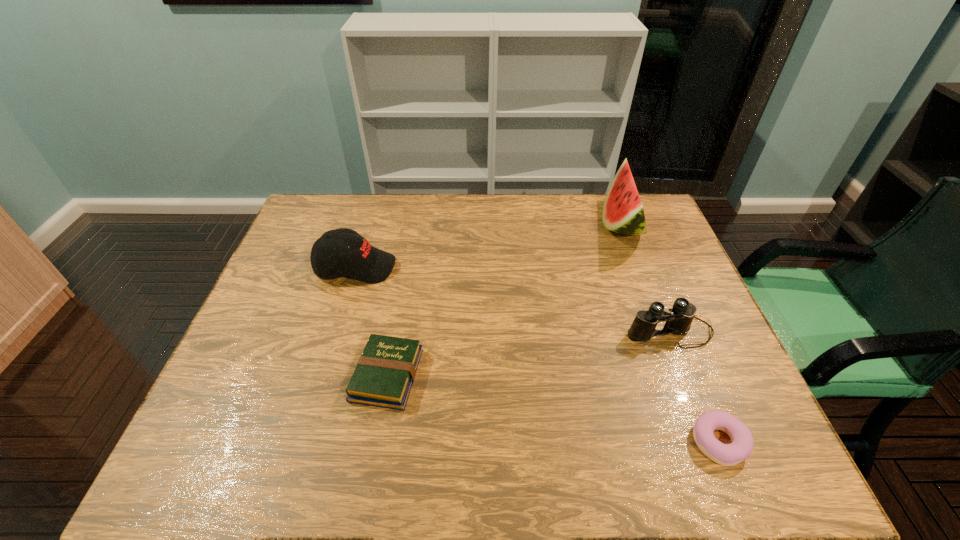
Where is `the tallest object`? Image resolution: width=960 pixels, height=540 pixels. the tallest object is located at coordinates (623, 212).

Where is `baseball cap`? The image size is (960, 540). baseball cap is located at coordinates (351, 255).

Locate an element on the screen. The image size is (960, 540). binoculars is located at coordinates (679, 320).

I want to click on book, so click(x=384, y=375).

Find the location of a particular element. pastry is located at coordinates (741, 447).

You are a GUI agent. You are given a task and a screenshot of the screen. Output one action in this format:
    pyautogui.click(x=<x>, y=<y>)
    Task: Click on the vacant region located on the outer rind of the watermelon
    The width and height of the screenshot is (960, 540).
    Given the screenshot: What is the action you would take?
    pyautogui.click(x=544, y=224)

Locate an element on the screen. The image size is (960, 540). vacant area located 0.340m on the outer rind of the watermelon is located at coordinates (500, 224).

Locate an element on the screen. The width and height of the screenshot is (960, 540). vacant space located 0.270m on the outer rind of the watermelon is located at coordinates (520, 224).

Locate an element on the screen. This screenshot has width=960, height=540. vacant space located 0.300m on the front-facing side of the baseball cap is located at coordinates (495, 267).

Where is `free space located on the front of the binoculars`? This screenshot has height=540, width=960. free space located on the front of the binoculars is located at coordinates (698, 404).